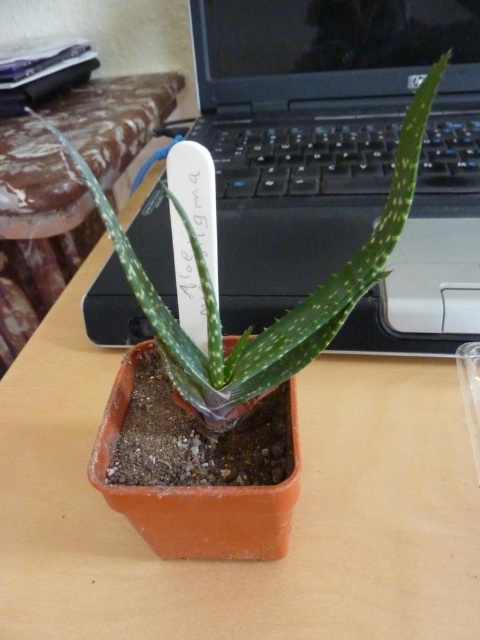
From the picture: You are organizing a desk and need to place a small figurine between the black plastic laptop at upper center and the green matte aloe vera at center. Which object should you place the figurine closer to if you want it to be on the taller side?

The black plastic laptop at upper center is much taller than the green matte aloe vera at center, so placing the figurine closer to the black plastic laptop at upper center would position it near the taller object.

From the picture: You are standing at the origin of the coordinate system in the image. You see two points, point (340, 74) and point (384, 212). Which point is closer to you?

Point (384, 212) is closer to you because it is in front of point (340, 74).